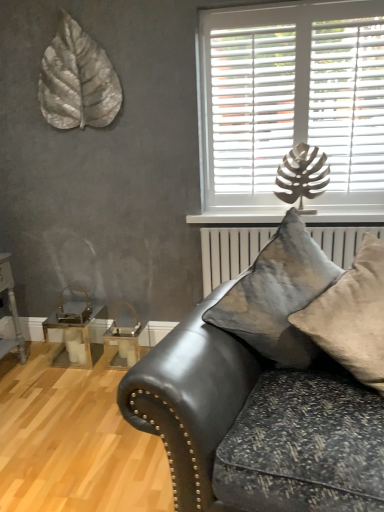
Question: Are white plastic blinds at upper right and clear glass table at lower left, the second table in the left-to-right sequence, making contact?

Choices:
 (A) no
 (B) yes

Answer: (A)

Question: From the image's perspective, is white plastic blinds at upper right under clear glass table at lower left, the second table in the left-to-right sequence?

Choices:
 (A) no
 (B) yes

Answer: (A)

Question: From the image's perspective, is white plastic blinds at upper right on top of clear glass table at lower left, the second table in the left-to-right sequence?

Choices:
 (A) yes
 (B) no

Answer: (A)

Question: Is white plastic blinds at upper right facing towards clear glass table at lower left, the second table in the left-to-right sequence?

Choices:
 (A) yes
 (B) no

Answer: (B)

Question: Does white plastic blinds at upper right lie in front of clear glass table at lower left, which appears as the first table when viewed from the right?

Choices:
 (A) yes
 (B) no

Answer: (A)

Question: Is white plastic blinds at upper right behind clear glass table at lower left, the second table in the left-to-right sequence?

Choices:
 (A) no
 (B) yes

Answer: (A)

Question: Is leather couch at lower right taller than velvet gray pillow at center, the first pillow positioned from the left?

Choices:
 (A) no
 (B) yes

Answer: (B)

Question: Does leather couch at lower right have a lesser height compared to velvet gray pillow at center, the first pillow positioned from the left?

Choices:
 (A) no
 (B) yes

Answer: (A)

Question: Does leather couch at lower right appear on the right side of velvet gray pillow at center, which is the 2th pillow in right-to-left order?

Choices:
 (A) yes
 (B) no

Answer: (B)

Question: Are leather couch at lower right and velvet gray pillow at center, which is the 2th pillow in right-to-left order, far apart?

Choices:
 (A) no
 (B) yes

Answer: (A)

Question: Does leather couch at lower right come in front of velvet gray pillow at center, the first pillow positioned from the left?

Choices:
 (A) yes
 (B) no

Answer: (A)

Question: From a real-world perspective, is leather couch at lower right on velvet gray pillow at center, which is the 2th pillow in right-to-left order?

Choices:
 (A) no
 (B) yes

Answer: (A)

Question: Can you confirm if textured beige pillow at center, which appears as the first pillow when viewed from the right, is thinner than metallic silver leaf at upper left?

Choices:
 (A) no
 (B) yes

Answer: (A)